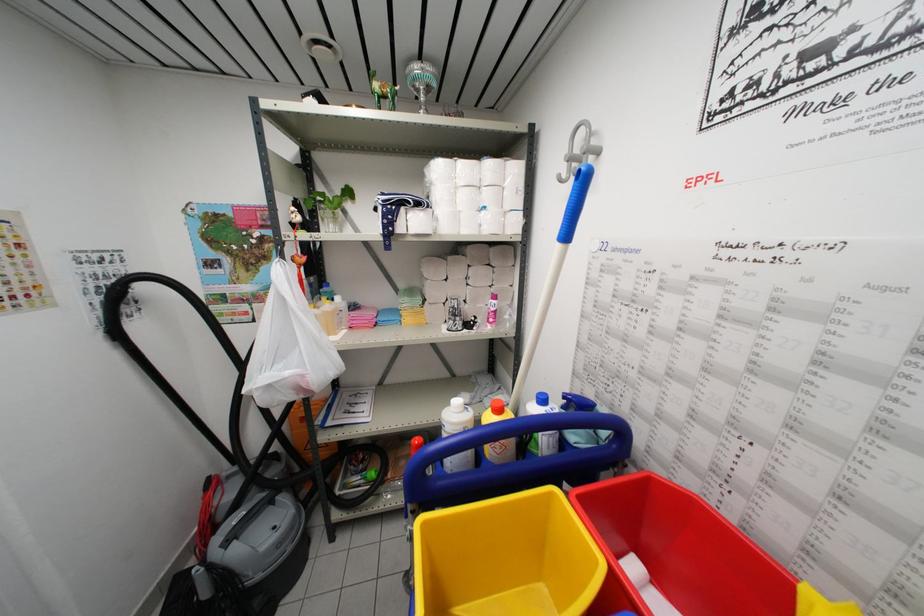
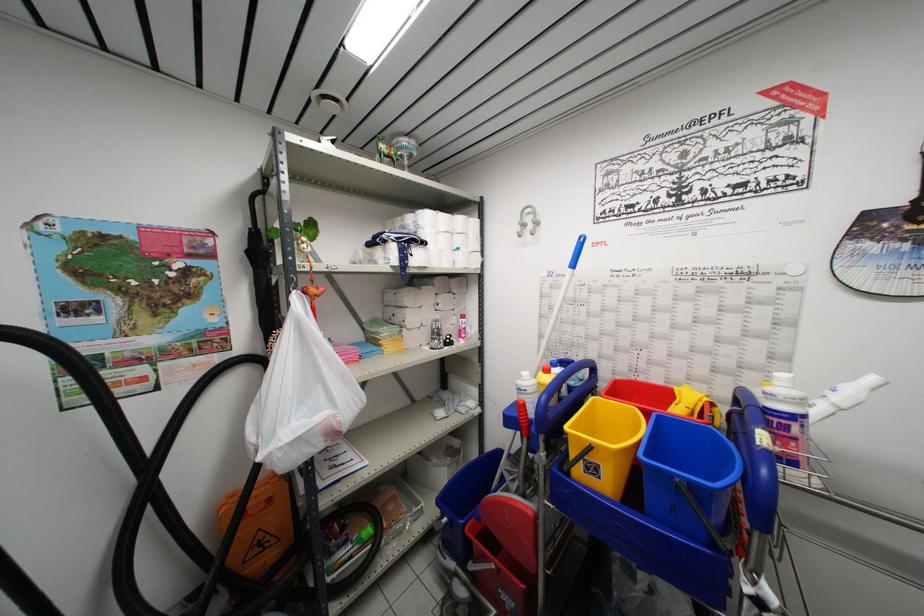
Locate, in the second image, the point that corresponds to the point at 458,164 in the first image.

(441, 217)